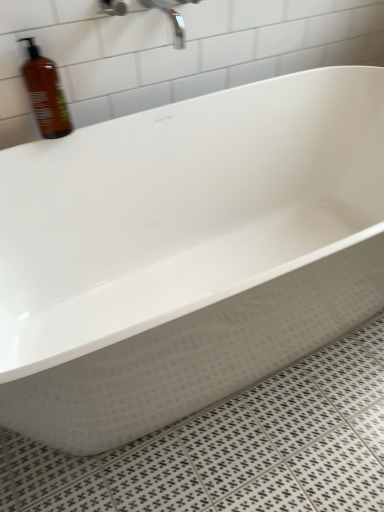
Question: Is brown matte bottle at upper left wider or thinner than polished chrome faucet at upper center?

Choices:
 (A) thin
 (B) wide

Answer: (A)

Question: Based on their sizes in the image, would you say brown matte bottle at upper left is bigger or smaller than polished chrome faucet at upper center?

Choices:
 (A) big
 (B) small

Answer: (A)

Question: Visually, is brown matte bottle at upper left positioned to the left or to the right of polished chrome faucet at upper center?

Choices:
 (A) right
 (B) left

Answer: (B)

Question: Would you say polished chrome faucet at upper center is inside or outside brown matte bottle at upper left?

Choices:
 (A) outside
 (B) inside

Answer: (A)

Question: In terms of height, does polished chrome faucet at upper center look taller or shorter compared to brown matte bottle at upper left?

Choices:
 (A) tall
 (B) short

Answer: (B)

Question: Would you say polished chrome faucet at upper center is to the left or to the right of brown matte bottle at upper left in the picture?

Choices:
 (A) right
 (B) left

Answer: (A)

Question: From the image's perspective, is polished chrome faucet at upper center positioned above or below brown matte bottle at upper left?

Choices:
 (A) below
 (B) above

Answer: (B)